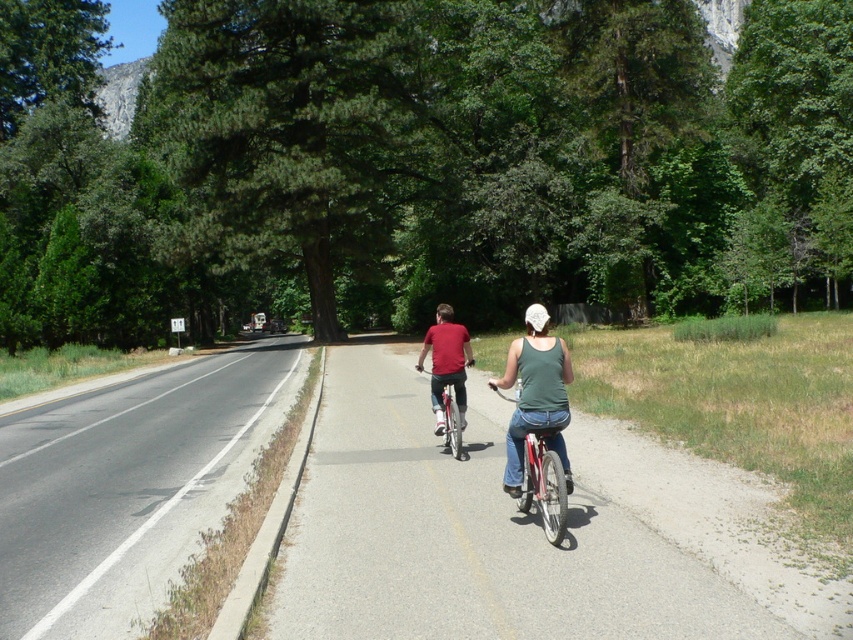
Question: Where is shiny metallic bicycle at center located in relation to white matte bicycle helmet at center in the image?

Choices:
 (A) left
 (B) right

Answer: (A)

Question: Which point is farther to the camera?

Choices:
 (A) (112, 420)
 (B) (317, 627)
 (C) (514, 470)
 (D) (544, 317)

Answer: (A)

Question: Is green fabric tank top at center bigger than matte red shirt at center?

Choices:
 (A) yes
 (B) no

Answer: (B)

Question: Based on their relative distances, which object is farther from the smooth asphalt bike path at center?

Choices:
 (A) green fabric tank top at center
 (B) shiny metallic bicycle at center

Answer: (A)

Question: Based on their relative distances, which object is farther from the asphalt road at left?

Choices:
 (A) green fabric tank top at center
 (B) white matte bicycle helmet at center
 (C) shiny metallic bicycle at center

Answer: (B)

Question: Does smooth asphalt bike path at center appear over asphalt road at left?

Choices:
 (A) yes
 (B) no

Answer: (A)